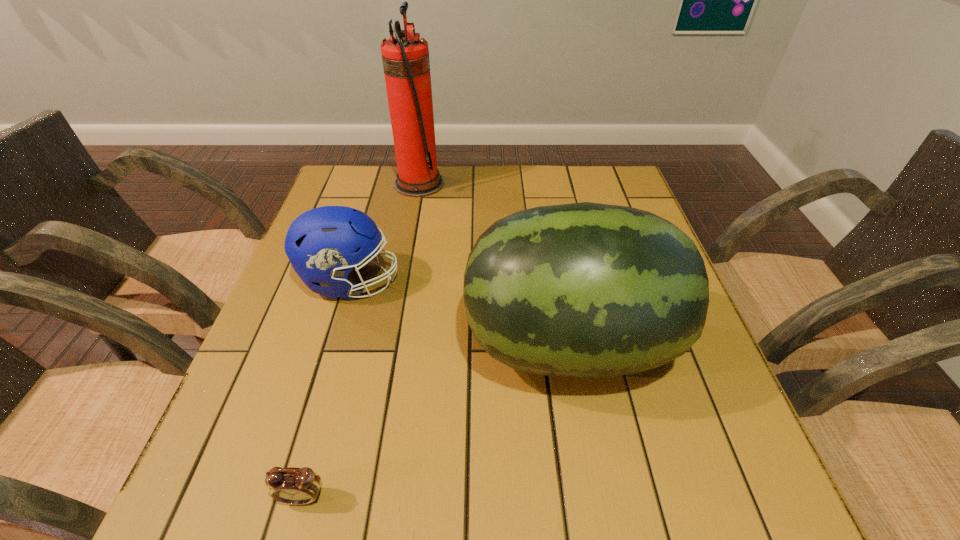
Locate an element on the screen. The height and width of the screenshot is (540, 960). free location that satisfies the following two spatial constraints: 1. on the front-facing side of the rightmost object; 2. on the left side of the football helmet is located at coordinates (332, 343).

You are a GUI agent. You are given a task and a screenshot of the screen. Output one action in this format:
    pyautogui.click(x=<x>, y=<y>)
    Task: Click on the vacant position in the image that satisfies the following two spatial constraints: 1. on the back side of the rightmost object; 2. on the front-facing side of the football helmet
    The image size is (960, 540).
    Given the screenshot: What is the action you would take?
    pyautogui.click(x=557, y=281)

You are a GUI agent. You are given a task and a screenshot of the screen. Output one action in this format:
    pyautogui.click(x=<x>, y=<y>)
    Task: Click on the free space that satisfies the following two spatial constraints: 1. on the front-facing side of the rightmost object; 2. on the left side of the football helmet
    The width and height of the screenshot is (960, 540).
    Given the screenshot: What is the action you would take?
    pyautogui.click(x=332, y=343)

Locate an element on the screen. The width and height of the screenshot is (960, 540). free space in the image that satisfies the following two spatial constraints: 1. on the front-facing side of the third tallest object; 2. on the back side of the rightmost object is located at coordinates (332, 343).

Identify the location of free space that satisfies the following two spatial constraints: 1. on the front-facing side of the third tallest object; 2. on the left side of the watermelon. This screenshot has height=540, width=960. (332, 343).

This screenshot has height=540, width=960. I want to click on vacant region that satisfies the following two spatial constraints: 1. on the front-facing side of the watermelon; 2. on the right side of the football helmet, so click(332, 343).

Identify the location of free region that satisfies the following two spatial constraints: 1. on the front-facing side of the rightmost object; 2. on the right side of the third tallest object. (332, 343).